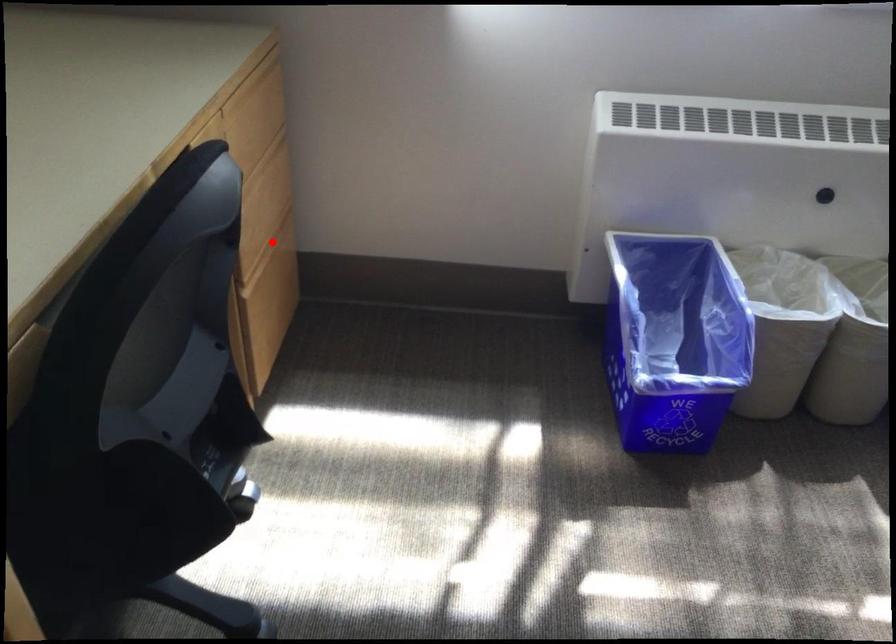
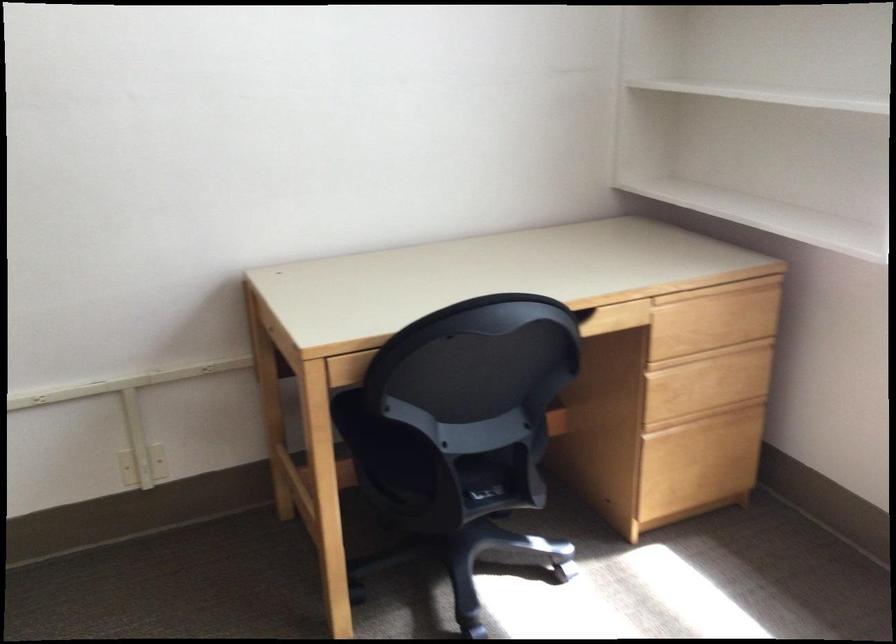
Question: I am providing you with two images of the same scene from different viewpoints. A red point is shown in image1. For the corresponding object point in image2, is it positioned nearer or farther from the camera?

Choices:
 (A) Nearer
 (B) Farther

Answer: (B)